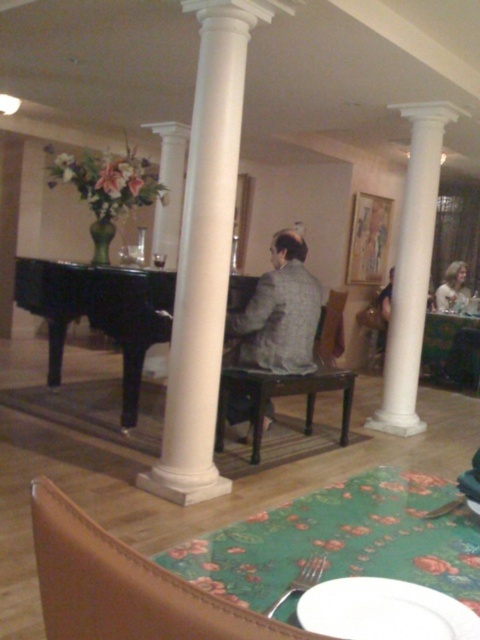
You are a photographer setting up for a formal event. You have to ensure that the gray woolen suit at center and the green fabric table at lower right are both visible in your frame. Given their size difference, which object might require you to adjust your camera angle to ensure it doesn not get lost in the background?

The green fabric table at lower right might require adjusting the camera angle since it is smaller in size compared to the gray woolen suit at center, ensuring it remains visible in the frame.